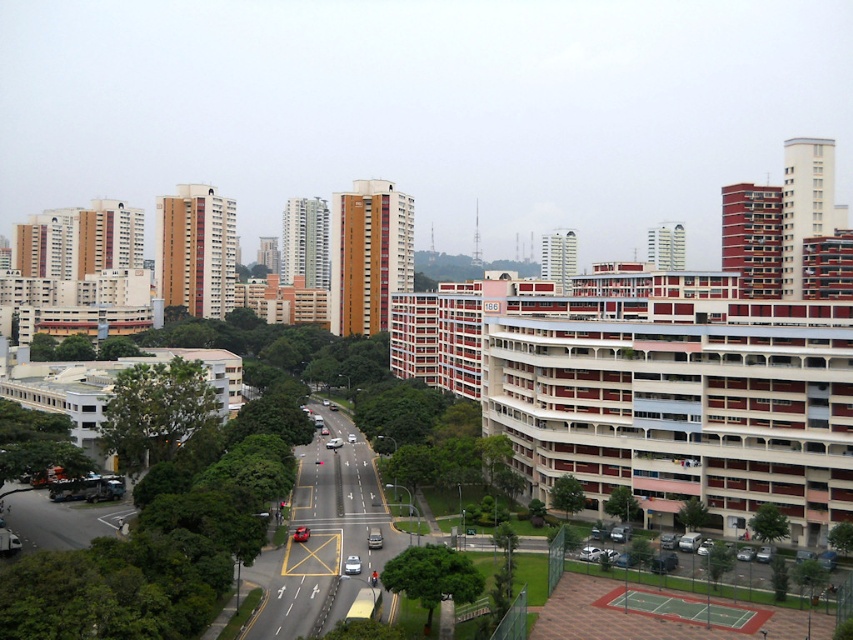
Who is more distant from viewer, (350, 572) or (325, 442)?

The point (325, 442) is more distant.

Does silver metallic car at center appear under shiny red sedan at center?

Correct, silver metallic car at center is located below shiny red sedan at center.

Locate an element on the screen. The image size is (853, 640). silver metallic car at center is located at coordinates (351, 564).

Does matte red car at center have a greater width compared to shiny red car at center?

In fact, matte red car at center might be narrower than shiny red car at center.

Where is `matte red car at center`? matte red car at center is located at coordinates (374, 540).

Can you confirm if matte red car at center is positioned to the right of shiny red sedan at center?

Indeed, matte red car at center is positioned on the right side of shiny red sedan at center.

Can you confirm if matte red car at center is smaller than shiny red sedan at center?

Yes.

Which is behind, point (369, 540) or point (325, 444)?

Point (325, 444)

Locate an element on the screen. This screenshot has height=640, width=853. matte red car at center is located at coordinates (374, 540).